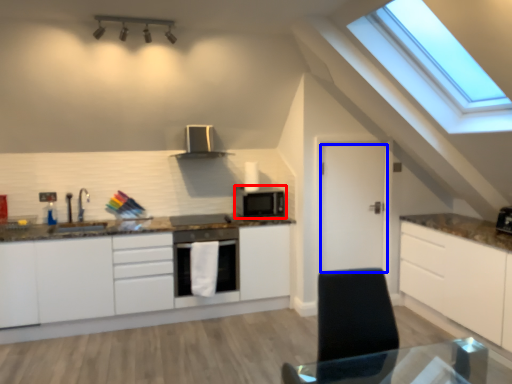
Question: Which point is closer to the camera, microwave oven (highlighted by a red box) or door (highlighted by a blue box)?

Choices:
 (A) microwave oven
 (B) door

Answer: (B)